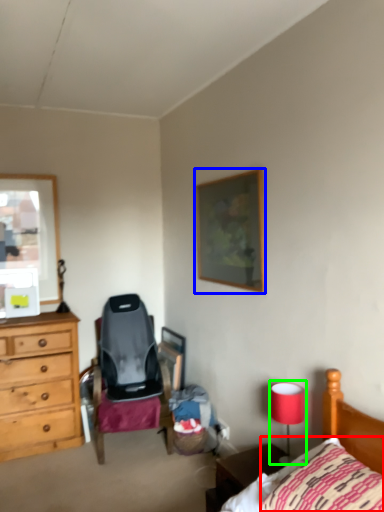
Question: Estimate the real-world distances between objects in this image. Which object is closer to pillow (highlighted by a red box), picture frame (highlighted by a blue box) or table lamp (highlighted by a green box)?

Choices:
 (A) picture frame
 (B) table lamp

Answer: (B)